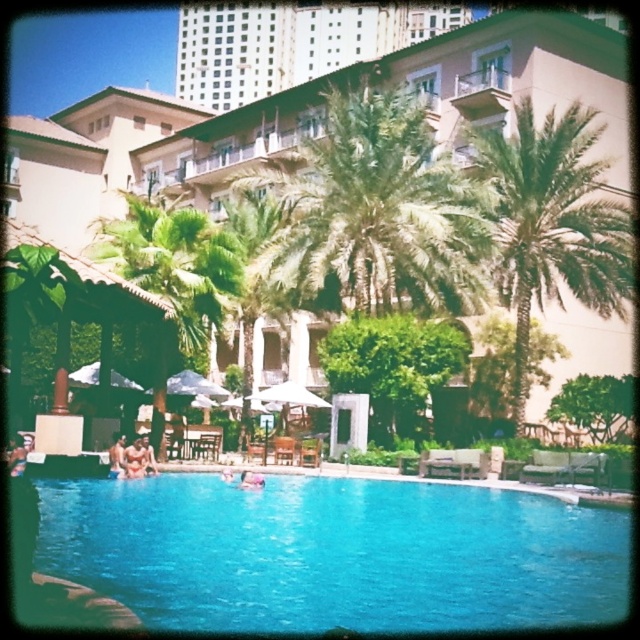
Question: Based on their relative distances, which object is nearer to the green leafy palm tree at center?

Choices:
 (A) smooth tan skin at center
 (B) blue glossy pool at center
 (C) green leafy palm tree at right
 (D) tan skin person at lower center

Answer: (C)

Question: Which point appears closest to the camera in this image?

Choices:
 (A) (241, 474)
 (B) (490, 529)
 (C) (557, 228)

Answer: (B)

Question: Can you confirm if blue glassy swimming pool at center is smaller than skinny jeans at lower left?

Choices:
 (A) yes
 (B) no

Answer: (B)

Question: Can you confirm if green leafy palm tree at center is wider than skinny jeans at lower left?

Choices:
 (A) no
 (B) yes

Answer: (B)

Question: Which point is closer to the camera?

Choices:
 (A) blue glossy pool at center
 (B) tan skin person at lower center
 (C) pink fabric at center
 (D) blue glassy swimming pool at center

Answer: (D)

Question: Can you confirm if green leafy palm tree at center is positioned to the left of green leafy palm tree at right?

Choices:
 (A) yes
 (B) no

Answer: (A)